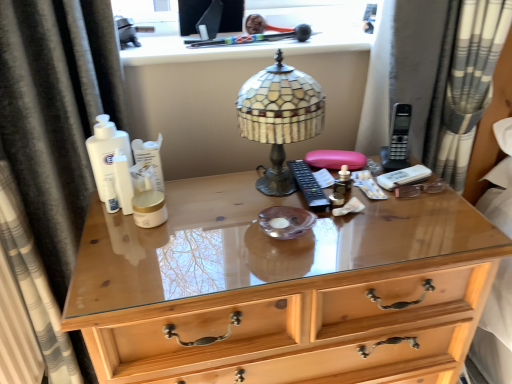
Where is `black fabric curtain at left, which is counted as the 2th curtain, starting from the right`? This screenshot has height=384, width=512. black fabric curtain at left, which is counted as the 2th curtain, starting from the right is located at coordinates (55, 115).

The width and height of the screenshot is (512, 384). What do you see at coordinates (430, 66) in the screenshot?
I see `gray striped curtain at right, which appears as the 2th curtain when viewed from the left` at bounding box center [430, 66].

Measure the distance between stained glass lampshade at center and camera.

The distance of stained glass lampshade at center from camera is 86.38 centimeters.

Find the location of a particular element. white matte lotion at center, marked as the second toiletry in a bottom-to-top arrangement is located at coordinates (150, 157).

Measure the distance between point (238, 286) and camera.

They are 77.30 centimeters apart.

What do you see at coordinates (281, 289) in the screenshot?
I see `wooden chest of drawers at center` at bounding box center [281, 289].

Find the location of a particular element. The height and width of the screenshot is (384, 512). black fabric curtain at left, which appears as the first curtain when viewed from the left is located at coordinates (55, 115).

Is gray striped curtain at right, which is counted as the first curtain, starting from the right, turned away from stained glass lampshade at center?

No.

From the image's perspective, which is below, gray striped curtain at right, which is counted as the first curtain, starting from the right, or stained glass lampshade at center?

stained glass lampshade at center is shown below in the image.

In terms of width, does gray striped curtain at right, which appears as the 2th curtain when viewed from the left, look wider or thinner when compared to stained glass lampshade at center?

In the image, gray striped curtain at right, which appears as the 2th curtain when viewed from the left, appears to be wider than stained glass lampshade at center.

From a real-world perspective, is gray striped curtain at right, which appears as the 2th curtain when viewed from the left, below stained glass lampshade at center?

No.

In terms of size, does gray striped curtain at right, which is counted as the first curtain, starting from the right, appear bigger or smaller than black fabric curtain at left, which appears as the first curtain when viewed from the left?

Clearly, gray striped curtain at right, which is counted as the first curtain, starting from the right, is smaller in size than black fabric curtain at left, which appears as the first curtain when viewed from the left.

Based on the photo, is gray striped curtain at right, which is counted as the first curtain, starting from the right, further to the viewer compared to black fabric curtain at left, which is counted as the 2th curtain, starting from the right?

Yes, it is.

Could you tell me if gray striped curtain at right, which is counted as the first curtain, starting from the right, is turned towards black fabric curtain at left, which appears as the first curtain when viewed from the left?

No, gray striped curtain at right, which is counted as the first curtain, starting from the right, is not turned towards black fabric curtain at left, which appears as the first curtain when viewed from the left.

Is gray striped curtain at right, which appears as the 2th curtain when viewed from the left, outside of black fabric curtain at left, which appears as the first curtain when viewed from the left?

Yes.

At what (x,y) coordinates should I click in order to perform the action: click on curtain below the stained glass lampshade at center (from a real-world perspective). Please return your answer as a coordinate pair (x, y). Looking at the image, I should click on (55, 115).

Can you confirm if black fabric curtain at left, which appears as the first curtain when viewed from the left, is positioned to the left of stained glass lampshade at center?

Correct, you'll find black fabric curtain at left, which appears as the first curtain when viewed from the left, to the left of stained glass lampshade at center.

Consider the image. Is black fabric curtain at left, which appears as the first curtain when viewed from the left, wider or thinner than stained glass lampshade at center?

black fabric curtain at left, which appears as the first curtain when viewed from the left, is thinner than stained glass lampshade at center.

From the image's perspective, which is below, black fabric curtain at left, which is counted as the 2th curtain, starting from the right, or stained glass lampshade at center?

black fabric curtain at left, which is counted as the 2th curtain, starting from the right.

From the image's perspective, between white matte lotion at center, which ranks as the first toiletry in back-to-front order, and black fabric curtain at left, which is counted as the 2th curtain, starting from the right, which one is located above?

white matte lotion at center, which ranks as the first toiletry in back-to-front order, from the image's perspective.

In the scene shown: Could you tell me if white matte lotion at center, the second toiletry in the front-to-back sequence, is turned towards black fabric curtain at left, which is counted as the 2th curtain, starting from the right?

No, white matte lotion at center, the second toiletry in the front-to-back sequence, is not turned towards black fabric curtain at left, which is counted as the 2th curtain, starting from the right.

In the image, is white matte lotion at center, the second toiletry in the front-to-back sequence, on the left side or the right side of black fabric curtain at left, which is counted as the 2th curtain, starting from the right?

From the image, it's evident that white matte lotion at center, the second toiletry in the front-to-back sequence, is to the right of black fabric curtain at left, which is counted as the 2th curtain, starting from the right.

Is black fabric curtain at left, which appears as the first curtain when viewed from the left, located within white matte lotion at center, which ranks as the first toiletry in back-to-front order?

Definitely not — black fabric curtain at left, which appears as the first curtain when viewed from the left, is not inside white matte lotion at center, which ranks as the first toiletry in back-to-front order.

You are a GUI agent. You are given a task and a screenshot of the screen. Output one action in this format:
    pyautogui.click(x=<x>, y=<y>)
    Task: Click on the curtain that is under the stained glass lampshade at center (from a real-world perspective)
    Image resolution: width=512 pixels, height=384 pixels.
    Given the screenshot: What is the action you would take?
    pyautogui.click(x=55, y=115)

Which is closer to the camera, (x=278, y=85) or (x=50, y=260)?

Positioned in front is point (x=278, y=85).

Would you say stained glass lampshade at center contains black fabric curtain at left, which appears as the first curtain when viewed from the left?

Definitely not — black fabric curtain at left, which appears as the first curtain when viewed from the left, is not inside stained glass lampshade at center.

Can you confirm if wooden chest of drawers at center is smaller than black fabric curtain at left, which appears as the first curtain when viewed from the left?

Actually, wooden chest of drawers at center might be larger than black fabric curtain at left, which appears as the first curtain when viewed from the left.

Identify the location of curtain in front of the wooden chest of drawers at center. This screenshot has width=512, height=384. (55, 115).

Is wooden chest of drawers at center placed right next to black fabric curtain at left, which appears as the first curtain when viewed from the left?

They are not placed beside each other.

Does wooden chest of drawers at center have a lesser width compared to black fabric curtain at left, which appears as the first curtain when viewed from the left?

Incorrect, the width of wooden chest of drawers at center is not less than that of black fabric curtain at left, which appears as the first curtain when viewed from the left.

Are black fabric curtain at left, which is counted as the 2th curtain, starting from the right, and gold matte jar at center, acting as the 2th toiletry starting from the back, far apart?

No, black fabric curtain at left, which is counted as the 2th curtain, starting from the right, is not far away from gold matte jar at center, acting as the 2th toiletry starting from the back.

Considering the sizes of objects black fabric curtain at left, which is counted as the 2th curtain, starting from the right, and gold matte jar at center, acting as the 2th toiletry starting from the back, in the image provided, who is smaller, black fabric curtain at left, which is counted as the 2th curtain, starting from the right, or gold matte jar at center, acting as the 2th toiletry starting from the back,?

Smaller between the two is gold matte jar at center, acting as the 2th toiletry starting from the back.

Considering the positions of objects black fabric curtain at left, which is counted as the 2th curtain, starting from the right, and gold matte jar at center, acting as the 1th toiletry starting from the bottom, in the image provided, who is behind, black fabric curtain at left, which is counted as the 2th curtain, starting from the right, or gold matte jar at center, acting as the 1th toiletry starting from the bottom,?

gold matte jar at center, acting as the 1th toiletry starting from the bottom, is behind.

Can you confirm if black fabric curtain at left, which is counted as the 2th curtain, starting from the right, is taller than gold matte jar at center, acting as the 1th toiletry starting from the bottom?

Correct, black fabric curtain at left, which is counted as the 2th curtain, starting from the right, is much taller as gold matte jar at center, acting as the 1th toiletry starting from the bottom.

This screenshot has width=512, height=384. Find the location of `curtain behind the stained glass lampshade at center`. curtain behind the stained glass lampshade at center is located at coordinates (430, 66).

Locate an element on the screen. The image size is (512, 384). curtain in front of the gray striped curtain at right, which is counted as the first curtain, starting from the right is located at coordinates (55, 115).

Considering their positions, is gold matte jar at center, acting as the 1th toiletry starting from the bottom, positioned closer to stained glass lampshade at center than white matte lotion at center, the second toiletry in the front-to-back sequence?

Based on the image, white matte lotion at center, the second toiletry in the front-to-back sequence, appears to be nearer to stained glass lampshade at center.

Estimate the real-world distances between objects in this image. Which object is further from gold matte jar at center, acting as the 1th toiletry starting from the bottom, black fabric curtain at left, which is counted as the 2th curtain, starting from the right, or wooden chest of drawers at center?

wooden chest of drawers at center is positioned further to the anchor gold matte jar at center, acting as the 1th toiletry starting from the bottom.

When comparing their distances from stained glass lampshade at center, does black fabric curtain at left, which is counted as the 2th curtain, starting from the right, or white matte lotion at center, the second toiletry in the front-to-back sequence, seem closer?

white matte lotion at center, the second toiletry in the front-to-back sequence, lies closer to stained glass lampshade at center than the other object.

Which object lies nearer to the anchor point gray striped curtain at right, which is counted as the first curtain, starting from the right, black fabric curtain at left, which appears as the first curtain when viewed from the left, or gold matte jar at center, acting as the 2th toiletry starting from the back?

The object closer to gray striped curtain at right, which is counted as the first curtain, starting from the right, is gold matte jar at center, acting as the 2th toiletry starting from the back.

Considering their positions, is gold matte jar at center, acting as the 1th toiletry starting from the bottom, positioned closer to wooden chest of drawers at center than white matte lotion at center, the second toiletry in the front-to-back sequence?

gold matte jar at center, acting as the 1th toiletry starting from the bottom.

Looking at the image, which one is located further to gray striped curtain at right, which is counted as the first curtain, starting from the right, wooden chest of drawers at center or black fabric curtain at left, which appears as the first curtain when viewed from the left?

black fabric curtain at left, which appears as the first curtain when viewed from the left, is positioned further to the anchor gray striped curtain at right, which is counted as the first curtain, starting from the right.

Which object lies nearer to the anchor point black fabric curtain at left, which is counted as the 2th curtain, starting from the right, gray striped curtain at right, which is counted as the first curtain, starting from the right, or stained glass lampshade at center?

Among the two, stained glass lampshade at center is located nearer to black fabric curtain at left, which is counted as the 2th curtain, starting from the right.

Based on the photo, considering their positions, is gray striped curtain at right, which appears as the 2th curtain when viewed from the left, positioned further to wooden chest of drawers at center than black fabric curtain at left, which appears as the first curtain when viewed from the left?

The object further to wooden chest of drawers at center is gray striped curtain at right, which appears as the 2th curtain when viewed from the left.

I want to click on lamp located between gold matte jar at center, acting as the 2th toiletry starting from the back, and gray striped curtain at right, which appears as the 2th curtain when viewed from the left, in the left-right direction, so click(x=279, y=117).

This screenshot has width=512, height=384. Find the location of `the chest of drawers located between white matte lotion at center, which ranks as the first toiletry in back-to-front order, and gray striped curtain at right, which appears as the 2th curtain when viewed from the left, in the left-right direction`. the chest of drawers located between white matte lotion at center, which ranks as the first toiletry in back-to-front order, and gray striped curtain at right, which appears as the 2th curtain when viewed from the left, in the left-right direction is located at coordinates (281, 289).

You are a GUI agent. You are given a task and a screenshot of the screen. Output one action in this format:
    pyautogui.click(x=<x>, y=<y>)
    Task: Click on the toiletry between white matte lotion at center, which ranks as the first toiletry in back-to-front order, and gray striped curtain at right, which appears as the 2th curtain when viewed from the left, from left to right
    The height and width of the screenshot is (384, 512).
    Given the screenshot: What is the action you would take?
    pyautogui.click(x=149, y=209)

Identify the location of chest of drawers between black fabric curtain at left, which appears as the first curtain when viewed from the left, and stained glass lampshade at center from left to right. Image resolution: width=512 pixels, height=384 pixels. (281, 289).